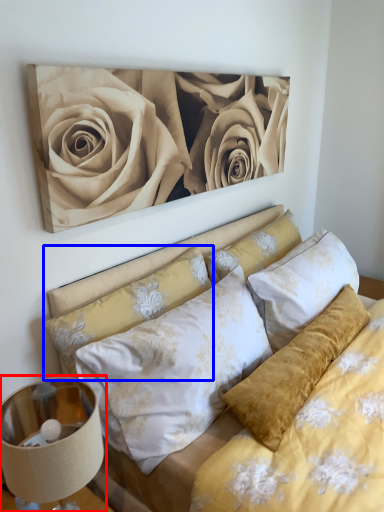
Question: Which point is further to the camera, lamp (highlighted by a red box) or pillow (highlighted by a blue box)?

Choices:
 (A) lamp
 (B) pillow

Answer: (B)